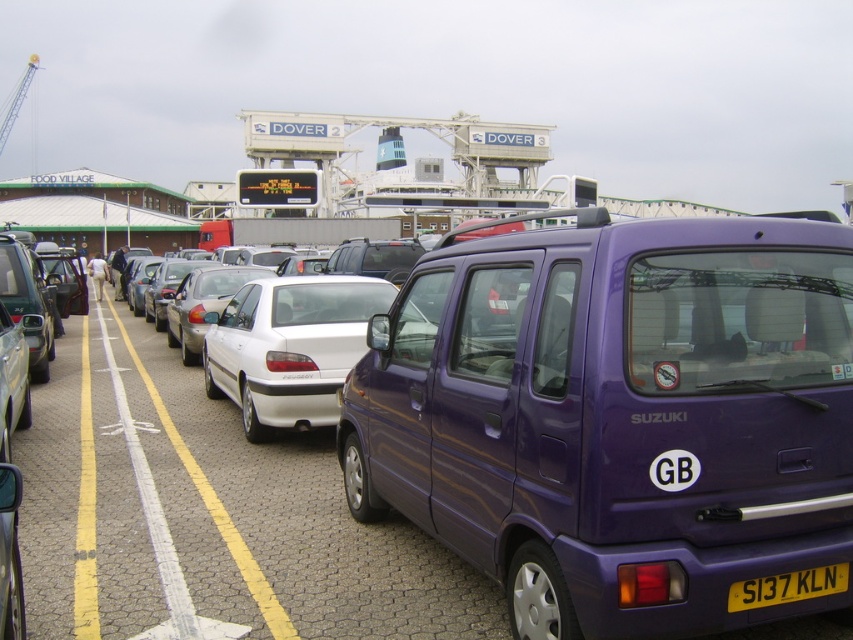
You are a delivery person who needs to park your 2.5m tall delivery truck in the parking area shown. You see the purple matte van at center and the yellow plastic license plate at lower right. Can you estimate if your truck will fit in the parking space between them?

The purple matte van at center is much taller than the yellow plastic license plate at lower right. Since your delivery truck is 2.5m tall, you need to ensure there is enough vertical clearance. However, the exact height of the parking space isn not specified, so it is uncertain if the truck will fit. Consider checking the parking area signage or measuring the available space before proceeding.